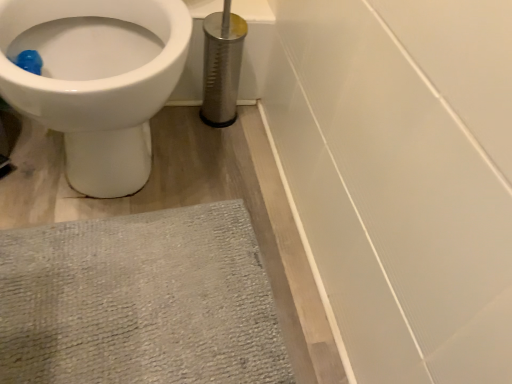
Question: Considering the positions of point (15, 340) and point (143, 61), is point (15, 340) closer or farther from the camera than point (143, 61)?

Choices:
 (A) farther
 (B) closer

Answer: (B)

Question: Considering the positions of gray textured bath mat at lower left and white glossy toilet at upper left in the image, is gray textured bath mat at lower left taller or shorter than white glossy toilet at upper left?

Choices:
 (A) tall
 (B) short

Answer: (B)

Question: Is gray textured bath mat at lower left spatially inside white glossy toilet at upper left, or outside of it?

Choices:
 (A) outside
 (B) inside

Answer: (A)

Question: Is white glossy toilet at upper left in front of or behind gray textured bath mat at lower left in the image?

Choices:
 (A) front
 (B) behind

Answer: (A)

Question: From a real-world perspective, relative to gray textured bath mat at lower left, is white glossy toilet at upper left vertically above or below?

Choices:
 (A) below
 (B) above

Answer: (B)

Question: Considering the positions of white glossy toilet at upper left and gray textured bath mat at lower left in the image, is white glossy toilet at upper left taller or shorter than gray textured bath mat at lower left?

Choices:
 (A) short
 (B) tall

Answer: (B)

Question: From the image's perspective, is white glossy toilet at upper left located above or below gray textured bath mat at lower left?

Choices:
 (A) below
 (B) above

Answer: (B)